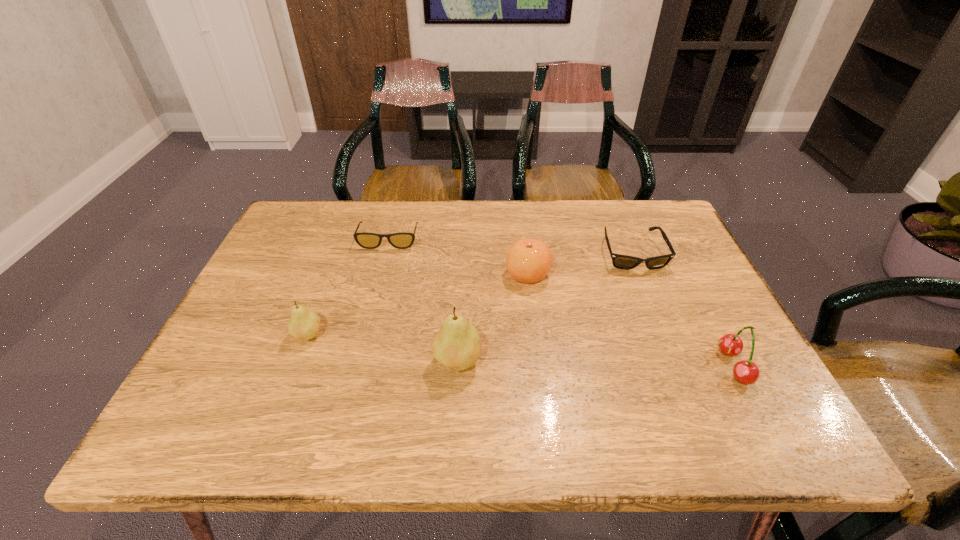
Identify the location of blank space located 0.130m on the right of the taller pear. Image resolution: width=960 pixels, height=540 pixels. (542, 361).

The image size is (960, 540). Find the location of `free space located on the front-facing side of the second object from right to left`. free space located on the front-facing side of the second object from right to left is located at coordinates (659, 318).

Where is `free space located 0.270m on the front-facing side of the second object from left to right`? The width and height of the screenshot is (960, 540). free space located 0.270m on the front-facing side of the second object from left to right is located at coordinates (368, 321).

This screenshot has height=540, width=960. In order to click on free space located 0.370m on the right of the fourth tallest object in this screenshot , I will do `click(692, 274)`.

I want to click on vacant space situated 0.100m with stems pointing upwards on the cherry, so click(x=674, y=366).

The height and width of the screenshot is (540, 960). In order to click on free space located 0.140m with stems pointing upwards on the cherry in this screenshot , I will do `click(655, 366)`.

Where is `free region located with stems pointing upwards on the cherry`? This screenshot has width=960, height=540. free region located with stems pointing upwards on the cherry is located at coordinates (687, 366).

Identify the location of pear at the near edge. This screenshot has height=540, width=960. (457, 346).

You are a GUI agent. You are given a task and a screenshot of the screen. Output one action in this format:
    pyautogui.click(x=<x>, y=<y>)
    Task: Click on the cherry at the near edge
    The width and height of the screenshot is (960, 540).
    Given the screenshot: What is the action you would take?
    pyautogui.click(x=746, y=372)

At what (x,y) coordinates should I click in order to perform the action: click on object positioned at the left edge. Please return your answer as a coordinate pair (x, y). Looking at the image, I should click on (304, 324).